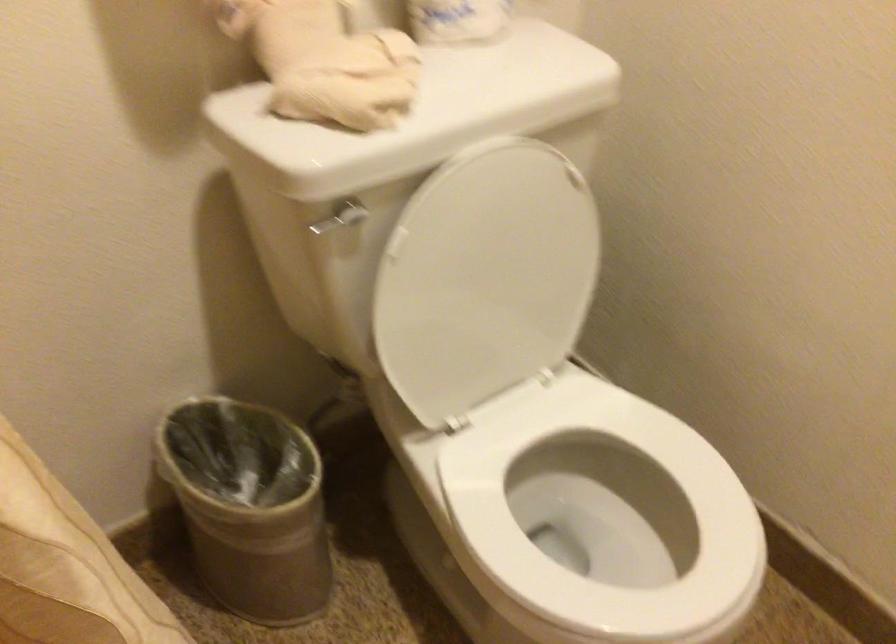
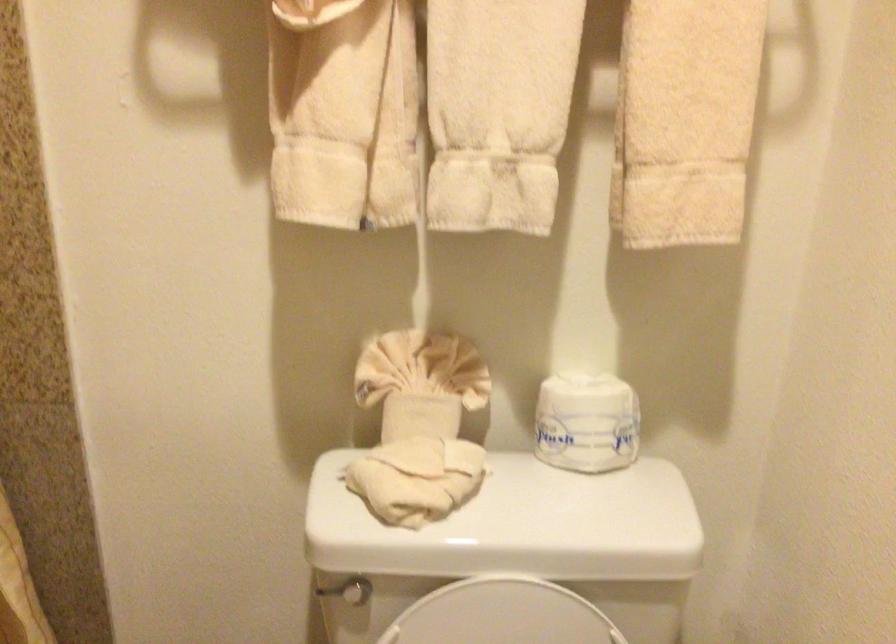
The point at (312, 222) is marked in the first image. Where is the corresponding point in the second image?

(326, 590)